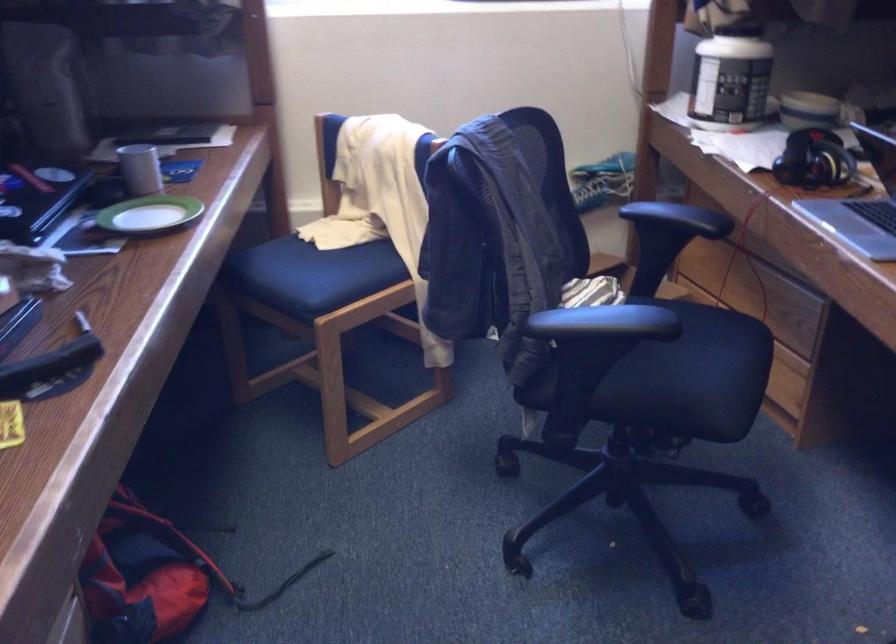
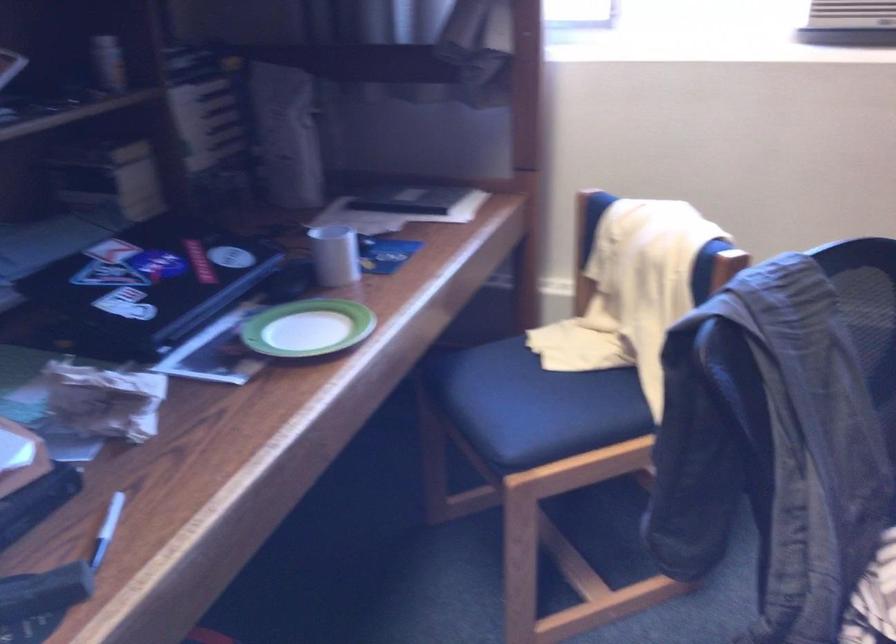
Question: What movement of the cameraman would produce the second image?

Choices:
 (A) Left
 (B) Right
 (C) Forward
 (D) Backward

Answer: (C)